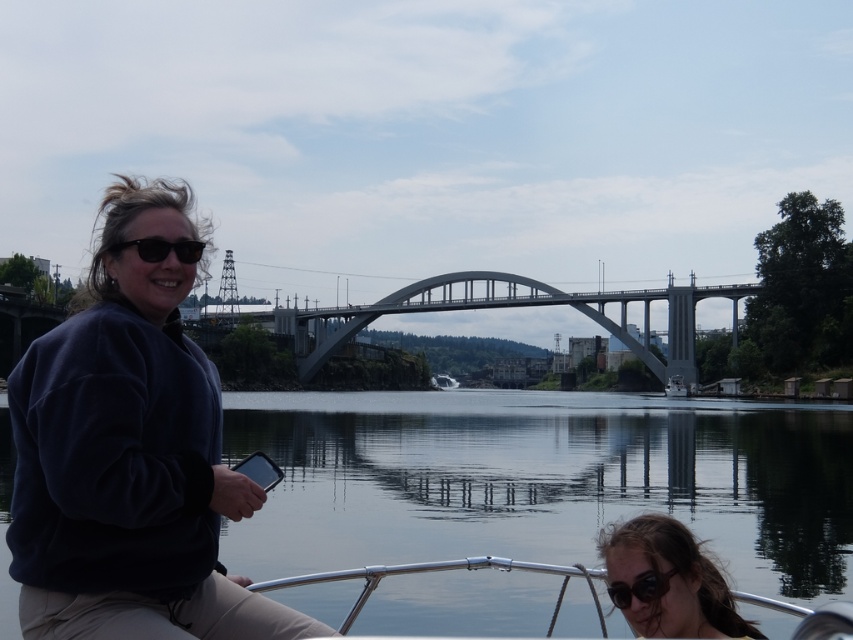
Question: Among these objects, which one is nearest to the camera?

Choices:
 (A) glossy water at center
 (B) dark blue fleece at left

Answer: (B)

Question: Considering the relative positions of black matte sunglasses at upper left and black matte sunglasses at lower center in the image provided, where is black matte sunglasses at upper left located with respect to black matte sunglasses at lower center?

Choices:
 (A) below
 (B) above

Answer: (B)

Question: Considering the real-world distances, which object is closest to the dark brown hair at lower right?

Choices:
 (A) glossy water at center
 (B) concrete bridge at center
 (C) black matte sunglasses at upper left
 (D) black matte sunglasses at lower center

Answer: (D)

Question: Does black matte sunglasses at upper left appear over black matte sunglasses at lower center?

Choices:
 (A) yes
 (B) no

Answer: (A)

Question: Does dark blue fleece at left appear over black matte sunglasses at upper left?

Choices:
 (A) yes
 (B) no

Answer: (A)

Question: Which object is positioned closest to the dark blue fleece at left?

Choices:
 (A) glossy water at center
 (B) concrete bridge at center
 (C) black matte sunglasses at lower center
 (D) black matte sunglasses at upper left

Answer: (D)